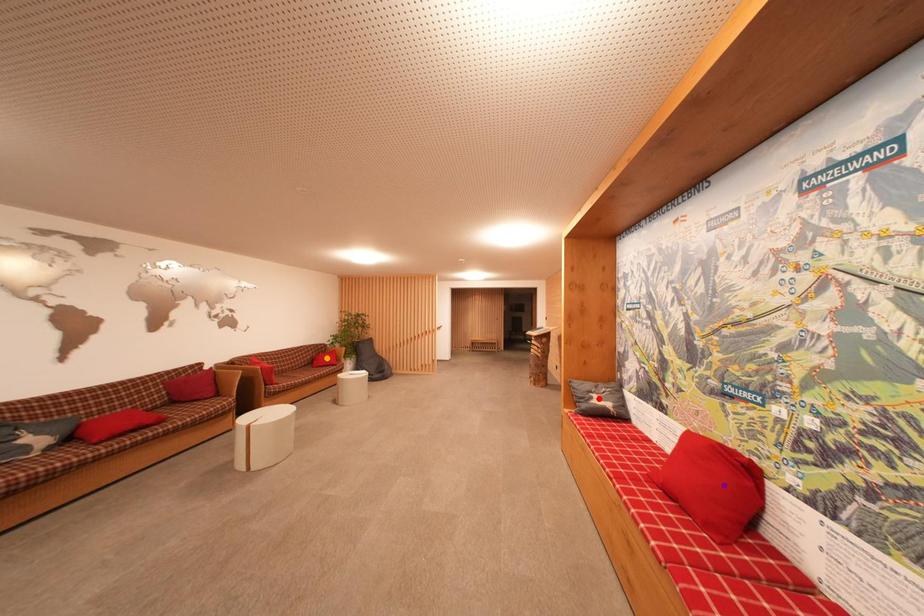
Order these from nearest to farthest:
purple point
red point
orange point

orange point < red point < purple point